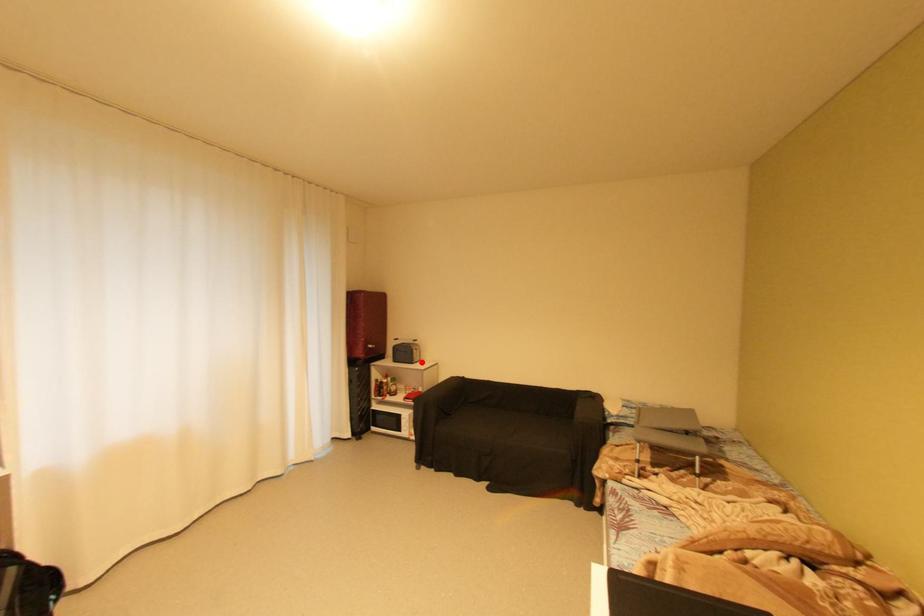
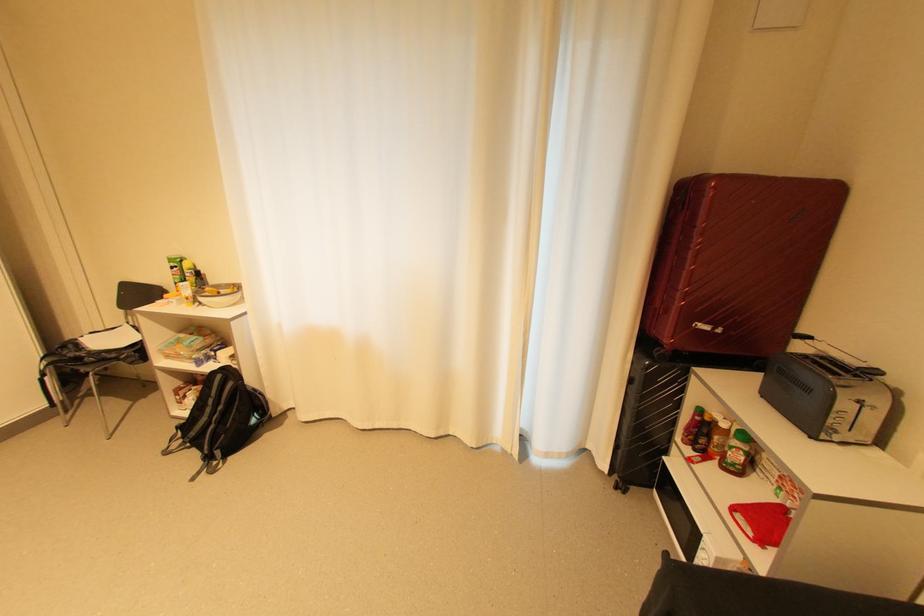
Where in the second image is the point corresponding to the highlighted location from the first image?

(830, 439)